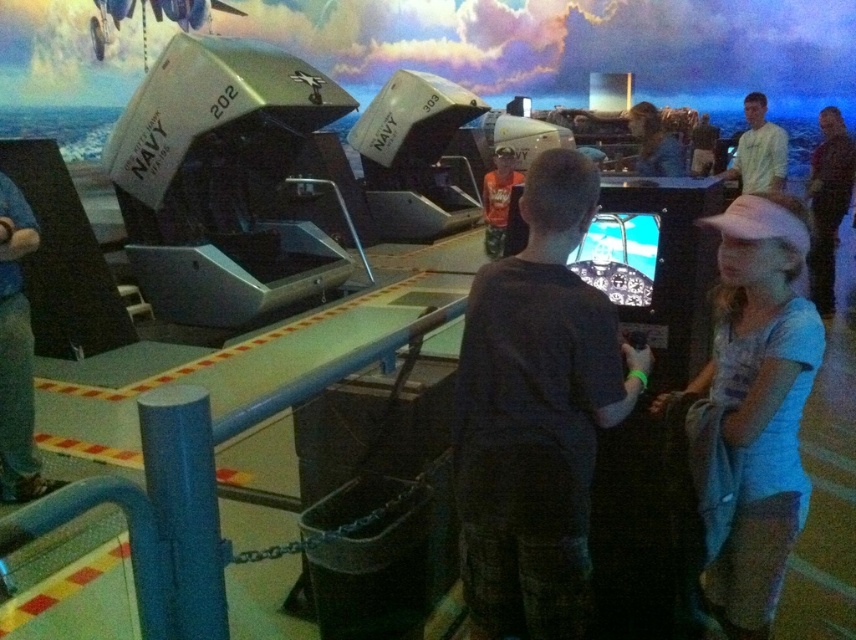
You are standing at the point marked by the coordinates point [480,627] in the exhibit. You want to move to the exit door located at the far end of the room. Considering your height is 5 feet 8 inches, will you be able to walk straight to the door without bending down?

The distance between you and the point [480,627] is 6.31 feet. Since the height of the exit door is not mentioned, but your height is 5 feet 8 inches, it is possible that you may not need to bend down, but there is insufficient information to confirm this definitively.

From the picture: What is located at the coordinate point (536, 413) in the image?

The dark gray shirt at center is located at point (536, 413).